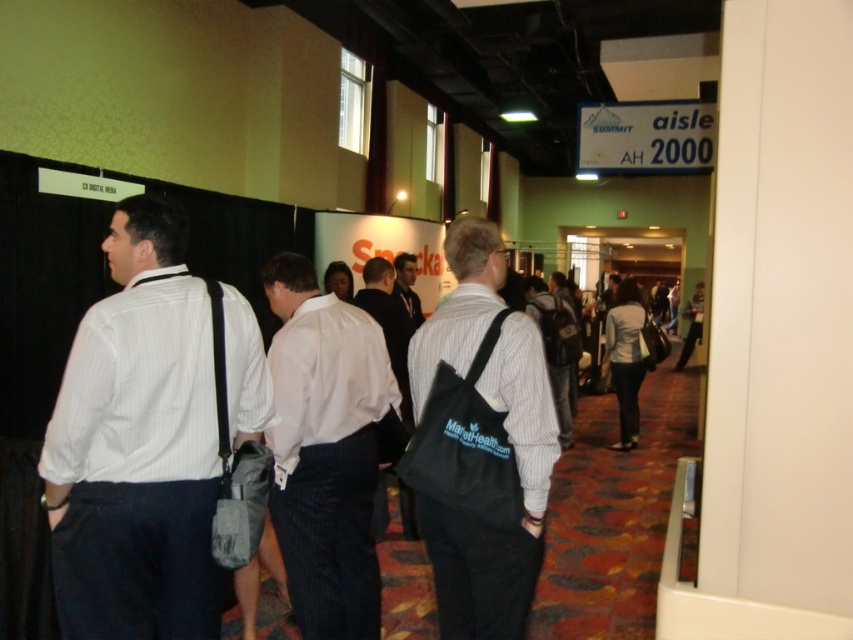
You are standing in the convention hall corridor and notice two people wearing a dark gray suit at center and a striped shirt at center. Which person is closer to you?

The dark gray suit at center is closer to the viewer than the striped shirt at center.

Consider the image. You are standing at the entrance of the convention hall and see two people wearing the white pinstripe shirt at center and the striped shirt at center. You need to deliver a package to the person closer to you. Which shirt should you approach?

The white pinstripe shirt at center is 3.81 meters away from the striped shirt at center. Since you are at the entrance, the person wearing the striped shirt at center is closer to you, so you should approach the striped shirt at center.

You are standing at the entrance of the corridor and see a person wearing a white pinstripe shirt at center. If you walk straight ahead, will you pass by the person before reaching the sign that says Summit?

The white pinstripe shirt at center is located at point (x=325, y=451). Since the Summit sign is further down the aisle, walking straight ahead would mean passing the person in the white pinstripe shirt at center before reaching the Summit sign.